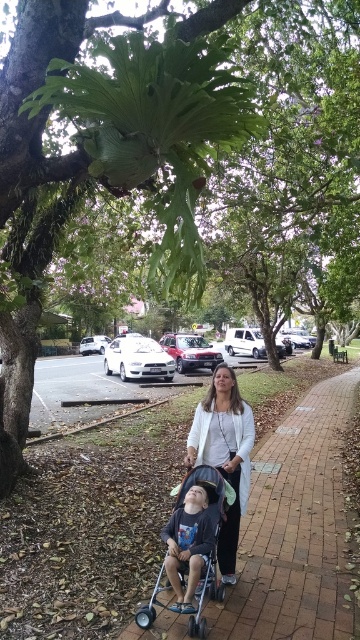
Does point (231, 531) come farther from viewer compared to point (189, 630)?

That is True.

Which is above, white matte jacket at center or metallic blue stroller at center?

Positioned higher is white matte jacket at center.

Image resolution: width=360 pixels, height=640 pixels. Identify the location of white matte jacket at center. (225, 454).

Does brick pavement at center have a lesser height compared to white matte jacket at center?

Yes, brick pavement at center is shorter than white matte jacket at center.

Can you confirm if brick pavement at center is positioned above white matte jacket at center?

Actually, brick pavement at center is below white matte jacket at center.

Who is more distant from viewer, (281, 586) or (209, 419)?

Positioned behind is point (209, 419).

This screenshot has width=360, height=640. I want to click on brick pavement at center, so click(294, 528).

You are a GUI agent. You are given a task and a screenshot of the screen. Output one action in this format:
    pyautogui.click(x=<x>, y=<y>)
    Task: Click on the brick pavement at center
    
    Given the screenshot: What is the action you would take?
    294,528

Does brick pavement at center have a smaller size compared to metallic blue stroller at center?

Actually, brick pavement at center might be larger than metallic blue stroller at center.

Between point (282, 529) and point (186, 545), which one is positioned in front?

Point (186, 545) is more forward.

The height and width of the screenshot is (640, 360). Identify the location of brick pavement at center. (294, 528).